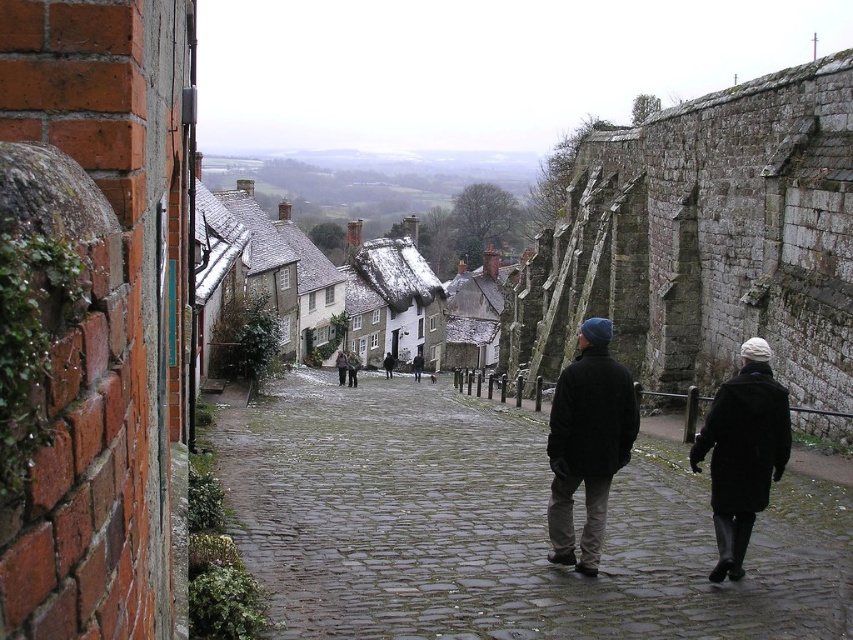
Question: Which point appears farthest from the camera in this image?

Choices:
 (A) (347, 372)
 (B) (378, 497)
 (C) (712, 573)

Answer: (A)

Question: Which of the following is the closest to the observer?

Choices:
 (A) (289, 214)
 (B) (601, 442)
 (C) (345, 358)

Answer: (B)

Question: In this image, where is wet cobblestone alley at center located relative to black wool coat at lower right?

Choices:
 (A) right
 (B) left

Answer: (B)

Question: Considering the relative positions of snow-covered thatched-roof houses at center and brown leather jacket at center in the image provided, where is snow-covered thatched-roof houses at center located with respect to brown leather jacket at center?

Choices:
 (A) above
 (B) below

Answer: (A)

Question: Which point is closer to the camera taking this photo?

Choices:
 (A) (428, 310)
 (B) (747, 531)

Answer: (B)

Question: Is wet cobblestone alley at center positioned before brown leather jacket at center?

Choices:
 (A) no
 (B) yes

Answer: (B)